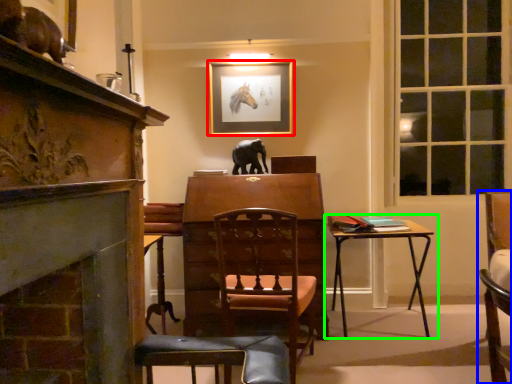
Question: Based on their relative distances, which object is farther from picture frame (highlighted by a red box)? Choose from chair (highlighted by a blue box) and table (highlighted by a green box).

Choices:
 (A) chair
 (B) table

Answer: (A)